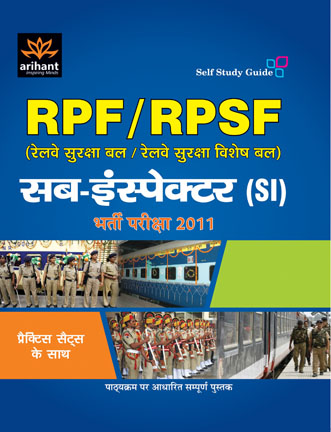
This screenshot has height=432, width=331. Identify the location of windows in train. (212, 271), (192, 275), (171, 272), (158, 275), (141, 275), (136, 274), (232, 332), (247, 324), (259, 327).